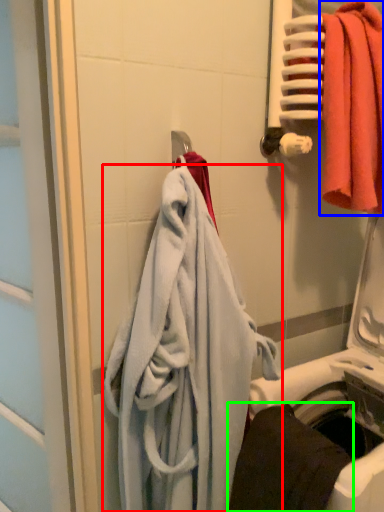
Question: Estimate the real-world distances between objects in this image. Which object is closer to towel (highlighted by a red box), towel (highlighted by a blue box) or towel (highlighted by a green box)?

Choices:
 (A) towel
 (B) towel

Answer: (B)